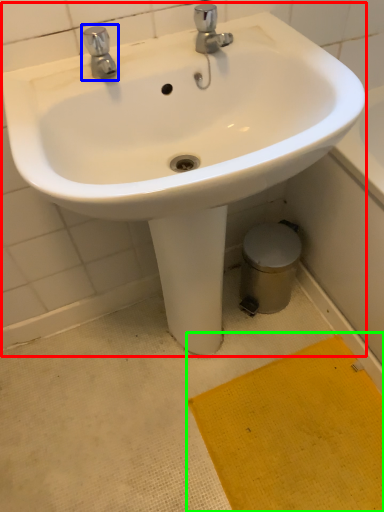
Question: Based on their relative distances, which object is farther from sink (highlighted by a red box)? Choose from tap (highlighted by a blue box) and doormat (highlighted by a green box).

Choices:
 (A) tap
 (B) doormat

Answer: (B)